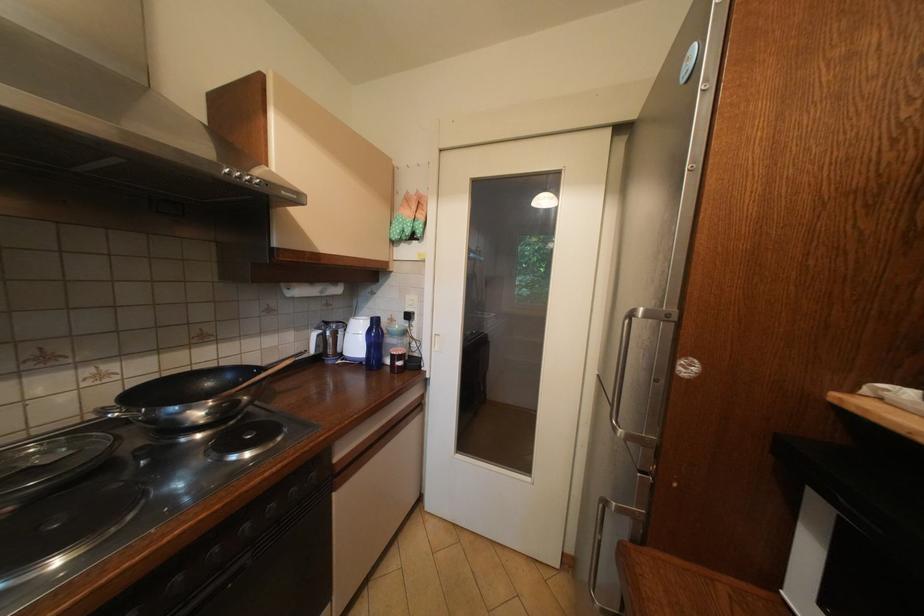
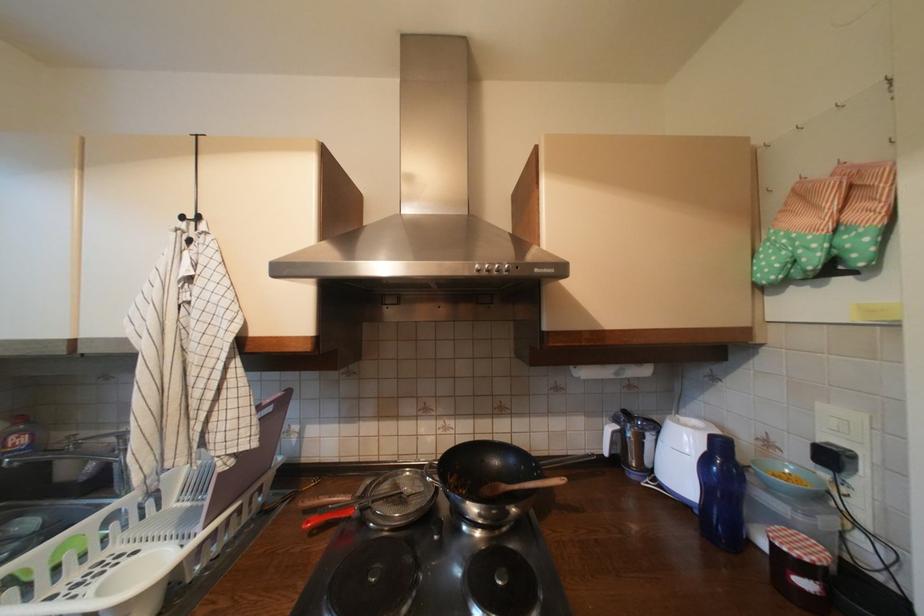
Where in the second image is the point corresponding to the point at 408,227 from the first image?

(793, 254)